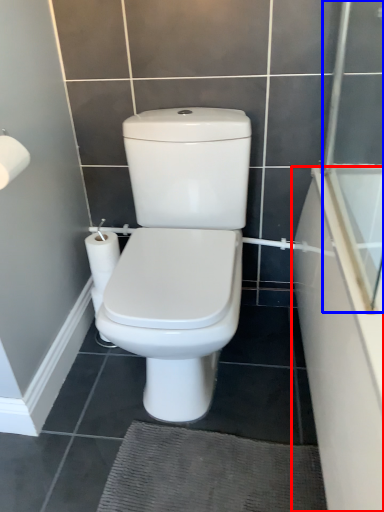
Question: Which object appears closest to the camera in this image, bath (highlighted by a red box) or screen door (highlighted by a blue box)?

Choices:
 (A) bath
 (B) screen door

Answer: (A)